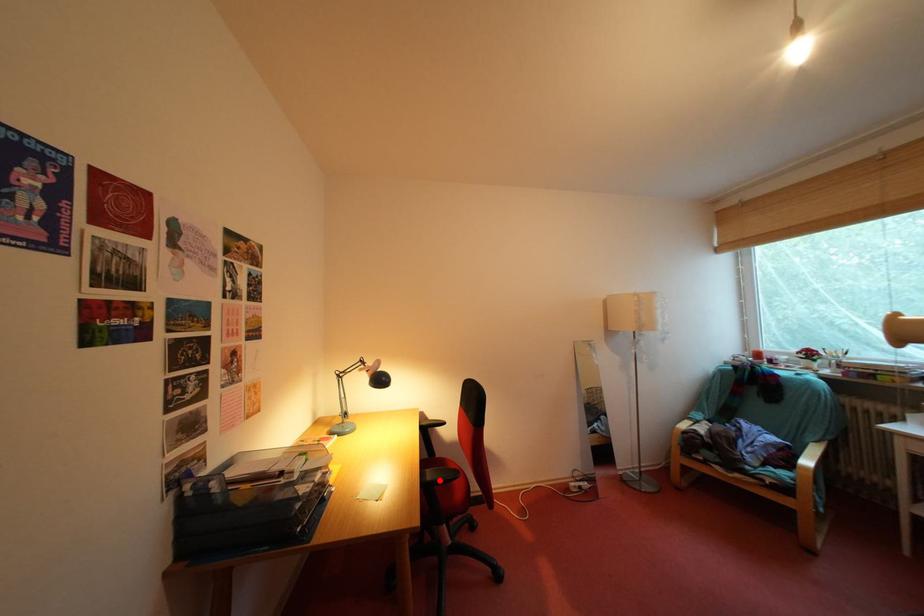
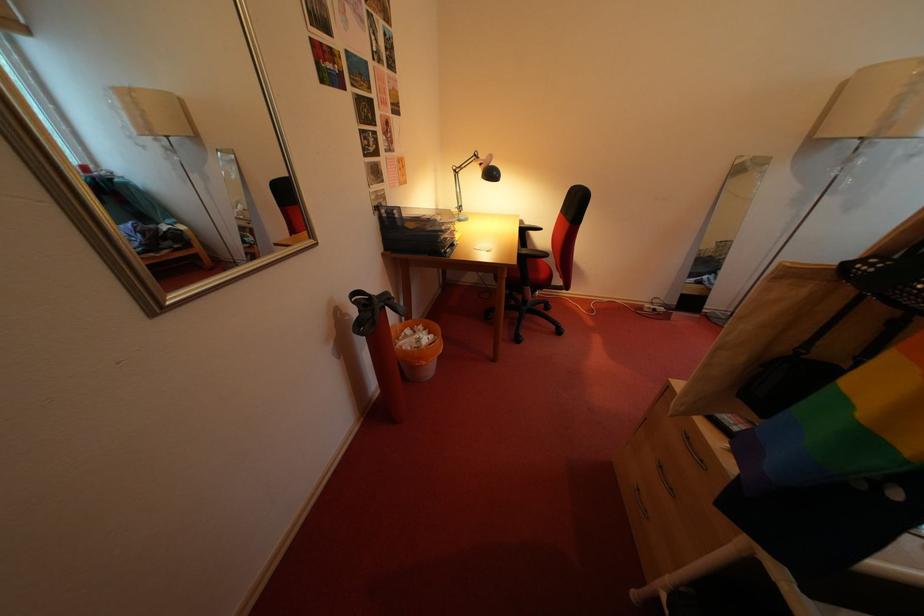
Question: I am providing you with two images of the same scene from different viewpoints. Image1 has a red point marked. In image2, the corresponding 3D location appears at what relative position? Reply with the corresponding letter.

Choices:
 (A) Closer
 (B) Farther

Answer: (B)